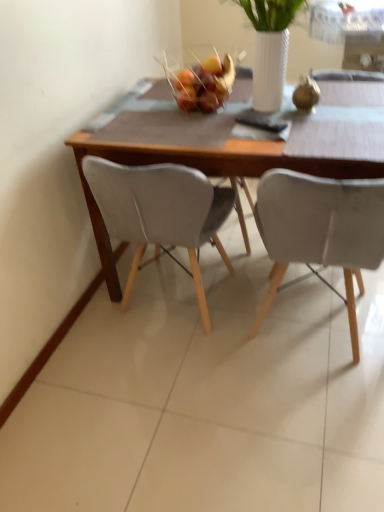
You are a GUI agent. You are given a task and a screenshot of the screen. Output one action in this format:
    pyautogui.click(x=<x>, y=<y>)
    Task: Click on the free spot to the right of glossy plastic fruit basket at center
    This screenshot has height=512, width=384.
    Given the screenshot: What is the action you would take?
    pyautogui.click(x=258, y=109)